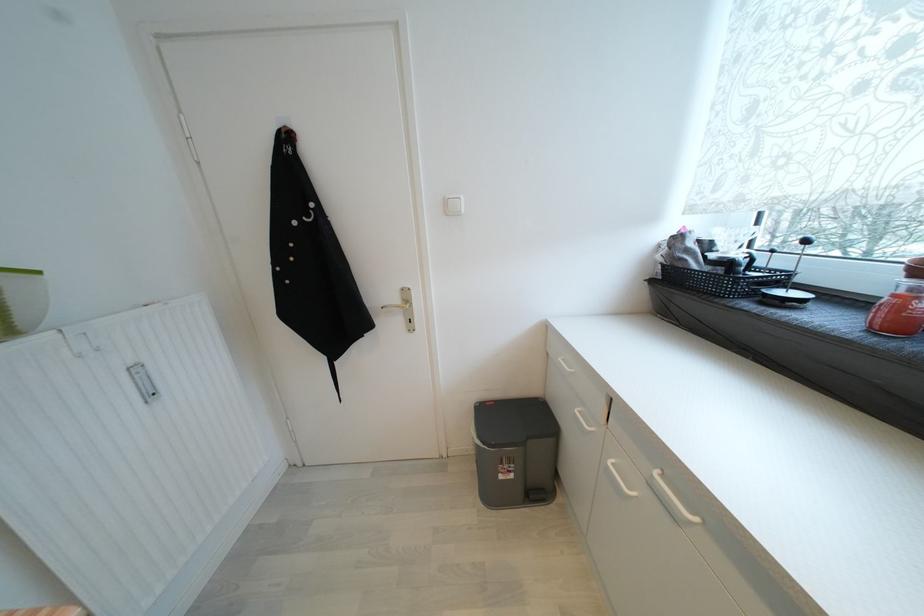
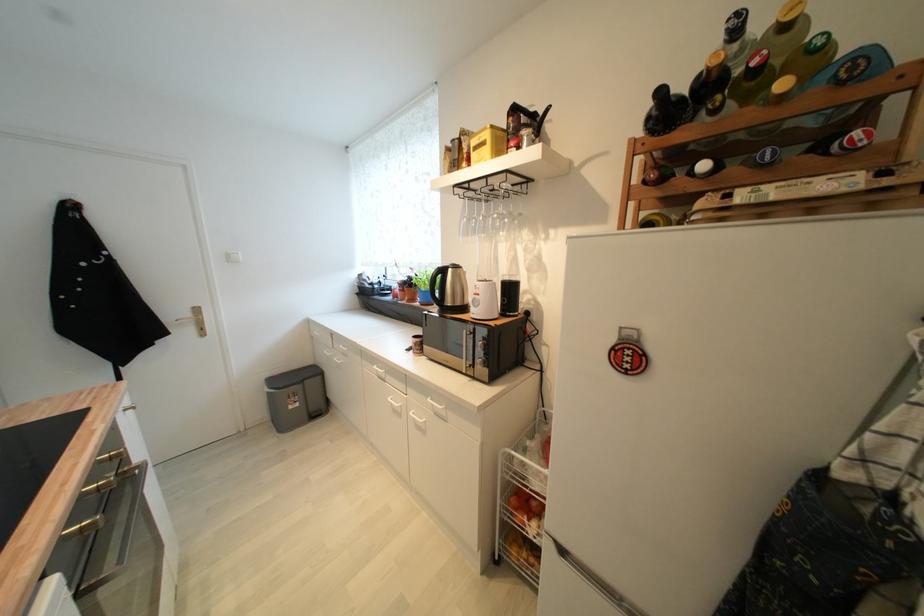
Where in the second image is the point corresponding to the point at 405,323 from the first image?

(197, 331)